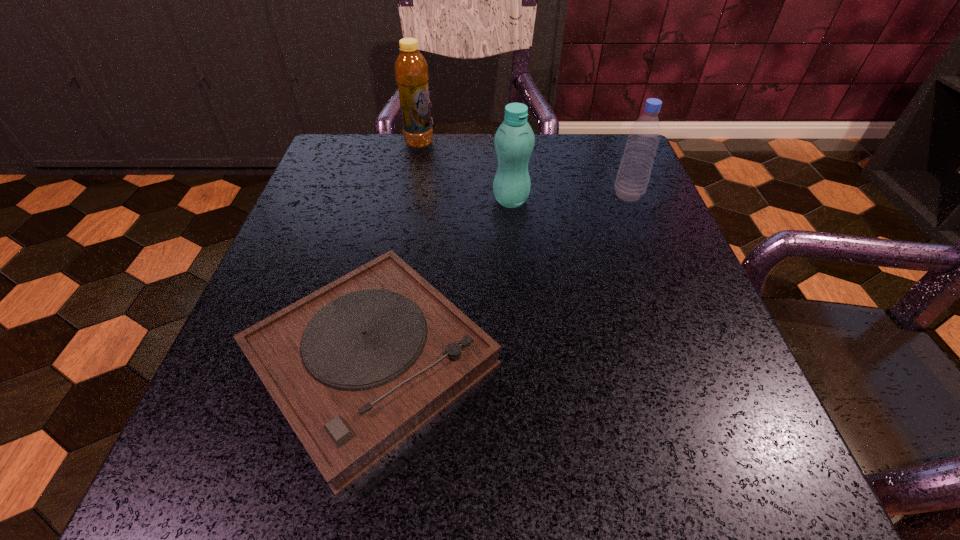
Identify which object is the third closest to the rightmost object. Please provide its 2D coordinates. Your answer should be formatted as a tuple, i.e. [(x, y)], where the tuple contains the x and y coordinates of a point satisfying the conditions above.

[(411, 71)]

Identify the location of object that is the second closest to the nearest object. (633, 175).

Where is `the closest bottle relative to the second bottle from right to left`? The image size is (960, 540). the closest bottle relative to the second bottle from right to left is located at coordinates (633, 175).

Identify which bottle is located as the nearest to the nearest object. Please provide its 2D coordinates. Your answer should be formatted as a tuple, i.e. [(x, y)], where the tuple contains the x and y coordinates of a point satisfying the conditions above.

[(514, 140)]

You are a GUI agent. You are given a task and a screenshot of the screen. Output one action in this format:
    pyautogui.click(x=<x>, y=<y>)
    Task: Click on the vacant space that satisfies the following two spatial constraints: 1. on the front side of the farthest object; 2. on the left side of the second bottle from right to left
    
    Given the screenshot: What is the action you would take?
    pyautogui.click(x=408, y=200)